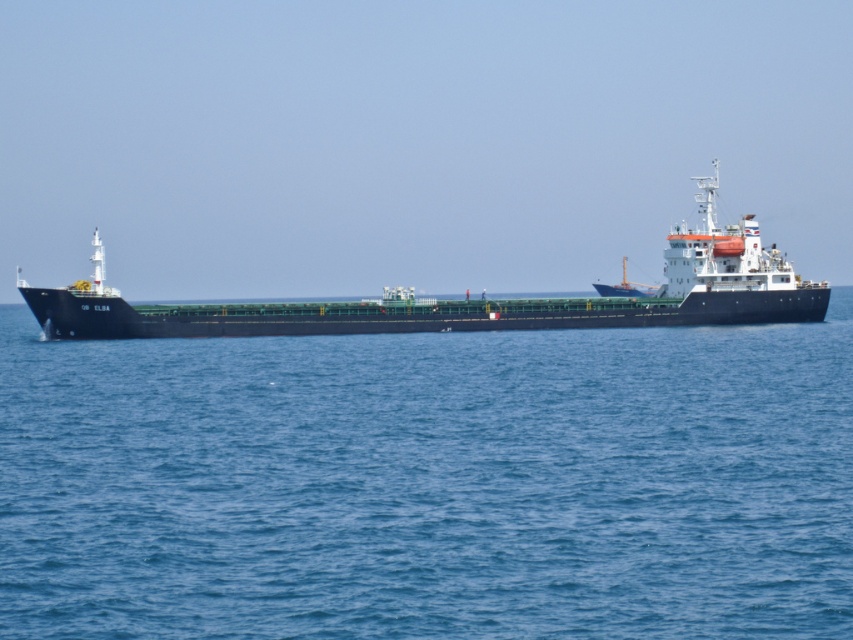
Question: Considering the relative positions of blue water at center and green matte ship at center in the image provided, where is blue water at center located with respect to green matte ship at center?

Choices:
 (A) right
 (B) left

Answer: (A)

Question: Is blue water at center smaller than green matte ship at center?

Choices:
 (A) no
 (B) yes

Answer: (B)

Question: Which point is closer to the camera?

Choices:
 (A) blue water at center
 (B) green matte ship at center

Answer: (A)

Question: Does blue water at center appear over green matte ship at center?

Choices:
 (A) yes
 (B) no

Answer: (B)